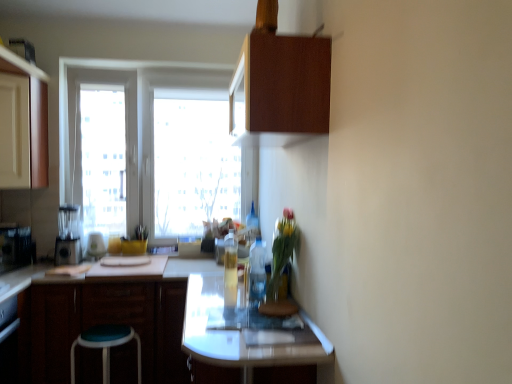
Question: Is translucent glass bottle at upper center, acting as the third bottle starting from the front, completely or partially inside matte wood cabinet at left, the second cabinetry positioned from the bottom?

Choices:
 (A) no
 (B) yes

Answer: (A)

Question: From the image's perspective, does matte wood cabinet at left, the second cabinetry in the top-to-bottom sequence, appear lower than translucent glass bottle at upper center, acting as the third bottle starting from the front?

Choices:
 (A) yes
 (B) no

Answer: (B)

Question: Considering the relative sizes of matte wood cabinet at left, positioned as the 3th cabinetry in right-to-left order, and translucent glass bottle at upper center, acting as the third bottle starting from the front, in the image provided, is matte wood cabinet at left, positioned as the 3th cabinetry in right-to-left order, smaller than translucent glass bottle at upper center, acting as the third bottle starting from the front,?

Choices:
 (A) no
 (B) yes

Answer: (A)

Question: Could you tell me if matte wood cabinet at left, the second cabinetry in the top-to-bottom sequence, is facing translucent glass bottle at upper center, arranged as the 1th bottle when viewed from the back?

Choices:
 (A) no
 (B) yes

Answer: (B)

Question: From a real-world perspective, is matte wood cabinet at left, positioned as the 3th cabinetry in right-to-left order, beneath translucent glass bottle at upper center, acting as the third bottle starting from the front?

Choices:
 (A) no
 (B) yes

Answer: (A)

Question: From the image's perspective, is matte black blender at left, which is the second appliance from left to right, located above or below wooden cabinet at upper center, which is the third cabinetry from bottom to top?

Choices:
 (A) below
 (B) above

Answer: (A)

Question: Is matte black blender at left, which is counted as the 2th appliance, starting from the right, bigger or smaller than wooden cabinet at upper center, the 1th cabinetry when ordered from top to bottom?

Choices:
 (A) small
 (B) big

Answer: (A)

Question: Which is correct: matte black blender at left, which is the second appliance from left to right, is inside wooden cabinet at upper center, which is the third cabinetry from bottom to top, or outside of it?

Choices:
 (A) inside
 (B) outside

Answer: (B)

Question: Is point (54, 258) positioned closer to the camera than point (280, 39)?

Choices:
 (A) farther
 (B) closer

Answer: (A)

Question: From the image's perspective, is translucent glass vase at center above or below matte wood cabinet at left, positioned as the 3th cabinetry in right-to-left order?

Choices:
 (A) below
 (B) above

Answer: (A)

Question: Choose the correct answer: Is translucent glass vase at center inside matte wood cabinet at left, positioned as the 3th cabinetry in right-to-left order, or outside it?

Choices:
 (A) inside
 (B) outside

Answer: (B)

Question: Considering the positions of translucent glass vase at center and matte wood cabinet at left, positioned as the 3th cabinetry in right-to-left order, in the image, is translucent glass vase at center taller or shorter than matte wood cabinet at left, positioned as the 3th cabinetry in right-to-left order,?

Choices:
 (A) short
 (B) tall

Answer: (A)

Question: Is point click(x=281, y=274) closer or farther from the camera than point click(x=34, y=96)?

Choices:
 (A) farther
 (B) closer

Answer: (B)

Question: Considering the positions of translucent glass bottle at center, the 3th bottle positioned from the back, and brushed metal blender at left, the 1th appliance from the right, in the image, is translucent glass bottle at center, the 3th bottle positioned from the back, bigger or smaller than brushed metal blender at left, the 1th appliance from the right,?

Choices:
 (A) small
 (B) big

Answer: (B)

Question: Is translucent glass bottle at center, which is the first bottle in front-to-back order, situated inside brushed metal blender at left, acting as the 3th appliance starting from the left, or outside?

Choices:
 (A) outside
 (B) inside

Answer: (A)